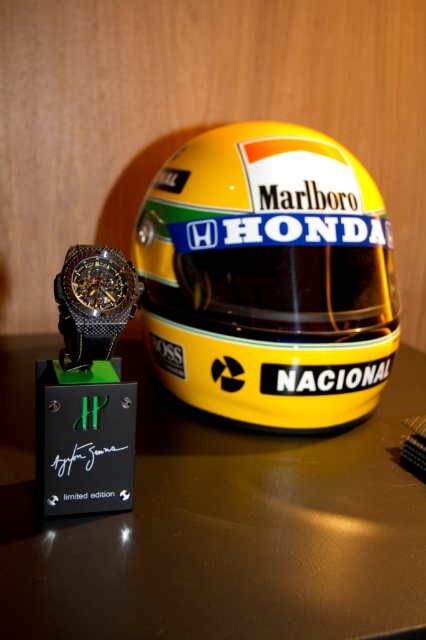
Question: Can you confirm if yellow matte helmet at center is positioned below black carbon fiber watch at left?

Choices:
 (A) no
 (B) yes

Answer: (A)

Question: Does yellow matte helmet at center have a smaller size compared to black carbon fiber watch at left?

Choices:
 (A) yes
 (B) no

Answer: (B)

Question: Among these objects, which one is nearest to the camera?

Choices:
 (A) black carbon fiber watch at left
 (B) yellow matte helmet at center

Answer: (A)

Question: Is yellow matte helmet at center below black carbon fiber watch at left?

Choices:
 (A) yes
 (B) no

Answer: (B)

Question: Which point appears farthest from the camera in this image?

Choices:
 (A) (129, 264)
 (B) (224, 212)

Answer: (B)